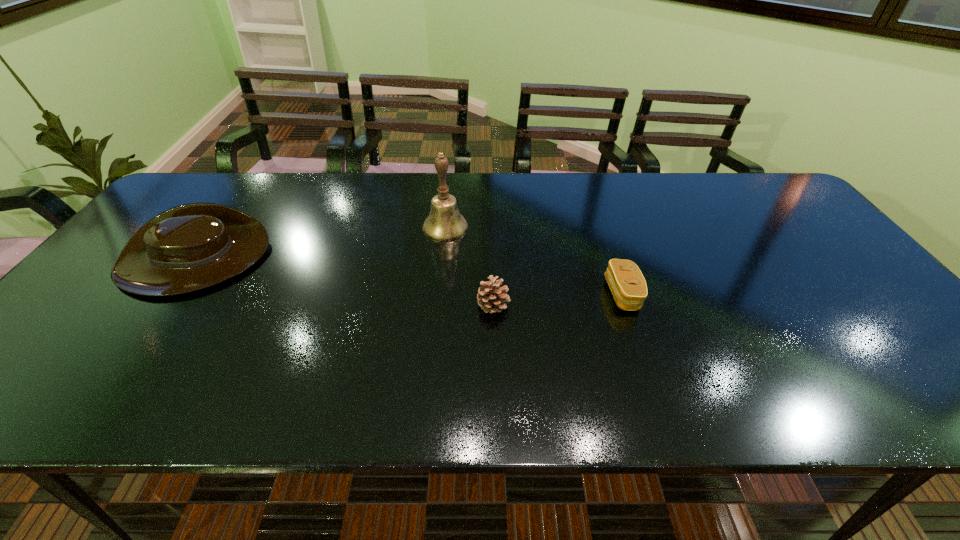
Find the location of a particular element. This screenshot has width=960, height=540. free space located on the zipper side of the clutch bag is located at coordinates (521, 294).

I want to click on free space located on the zipper side of the clutch bag, so click(x=477, y=294).

Locate an element on the screen. object that is at the far edge is located at coordinates [445, 223].

You are a GUI agent. You are given a task and a screenshot of the screen. Output one action in this format:
    pyautogui.click(x=<x>, y=<y>)
    Task: Click on the object at the left edge
    
    Given the screenshot: What is the action you would take?
    pyautogui.click(x=190, y=247)

Identify the location of free point at the far edge. (399, 180).

Where is `blank space at the near edge`? This screenshot has height=540, width=960. blank space at the near edge is located at coordinates (96, 387).

Locate an element on the screen. blank space at the right edge of the desktop is located at coordinates (841, 262).

The width and height of the screenshot is (960, 540). In the image, there is a desktop. What are the coordinates of `vacant region at the far left corner` in the screenshot? It's located at (228, 177).

The height and width of the screenshot is (540, 960). What are the coordinates of `vacant area that lies between the rightmost object and the leftmost object` in the screenshot? It's located at (407, 277).

Where is `free space that is in between the third object from left to right and the tallest object`? free space that is in between the third object from left to right and the tallest object is located at coordinates (469, 266).